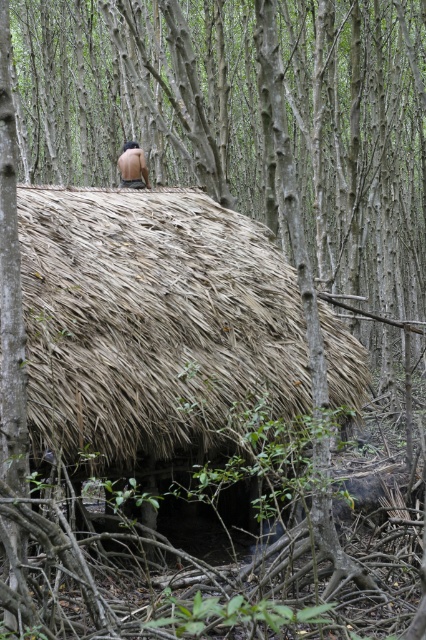
You are standing in front of the rustic hut in the dense forest. You notice both the brown thatch roof at center and the brown leather back at center. Which object is nearer to you?

The brown thatch roof at center is closer to the viewer than the brown leather back at center.